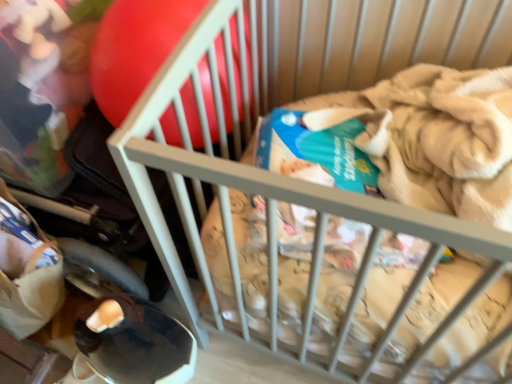
What do you see at coordinates (135, 49) in the screenshot?
I see `rubberized red balloon at upper left` at bounding box center [135, 49].

The height and width of the screenshot is (384, 512). What are the coordinates of `rubberized red balloon at upper left` in the screenshot? It's located at (135, 49).

Locate an element on the screen. The image size is (512, 384). rubberized red balloon at upper left is located at coordinates (135, 49).